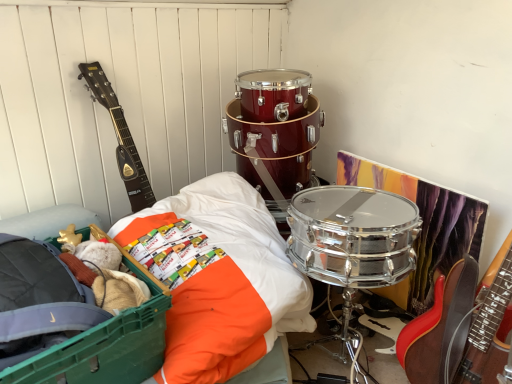
Question: Considering the relative sizes of orange fabric bedsheet at center-left and green plastic storage box at lower left in the image provided, is orange fabric bedsheet at center-left taller than green plastic storage box at lower left?

Choices:
 (A) no
 (B) yes

Answer: (B)

Question: Is orange fabric bedsheet at center-left placed right next to green plastic storage box at lower left?

Choices:
 (A) yes
 (B) no

Answer: (B)

Question: From a real-world perspective, is orange fabric bedsheet at center-left on top of green plastic storage box at lower left?

Choices:
 (A) yes
 (B) no

Answer: (B)

Question: Is orange fabric bedsheet at center-left wider than green plastic storage box at lower left?

Choices:
 (A) no
 (B) yes

Answer: (B)

Question: From a real-world perspective, is orange fabric bedsheet at center-left positioned under green plastic storage box at lower left based on gravity?

Choices:
 (A) yes
 (B) no

Answer: (A)

Question: Which is correct: orange fabric bedsheet at center-left is inside dark wood acoustic guitar at left, or outside of it?

Choices:
 (A) outside
 (B) inside

Answer: (A)

Question: From a real-world perspective, is orange fabric bedsheet at center-left above or below dark wood acoustic guitar at left?

Choices:
 (A) above
 (B) below

Answer: (B)

Question: Looking at their shapes, would you say orange fabric bedsheet at center-left is wider or thinner than dark wood acoustic guitar at left?

Choices:
 (A) wide
 (B) thin

Answer: (A)

Question: Based on their positions, is orange fabric bedsheet at center-left located to the left or right of dark wood acoustic guitar at left?

Choices:
 (A) right
 (B) left

Answer: (A)

Question: From a real-world perspective, is green plastic storage box at lower left above or below orange fabric bedsheet at center-left?

Choices:
 (A) below
 (B) above

Answer: (B)

Question: Is green plastic storage box at lower left in front of or behind orange fabric bedsheet at center-left in the image?

Choices:
 (A) front
 (B) behind

Answer: (A)

Question: Considering the positions of green plastic storage box at lower left and orange fabric bedsheet at center-left in the image, is green plastic storage box at lower left taller or shorter than orange fabric bedsheet at center-left?

Choices:
 (A) tall
 (B) short

Answer: (B)

Question: Is point (82, 334) positioned closer to the camera than point (143, 213)?

Choices:
 (A) farther
 (B) closer

Answer: (B)

Question: Looking at the image, does dark wood acoustic guitar at left seem bigger or smaller compared to green plastic storage box at lower left?

Choices:
 (A) big
 (B) small

Answer: (B)

Question: Considering the positions of point (132, 208) and point (158, 281), is point (132, 208) closer or farther from the camera than point (158, 281)?

Choices:
 (A) closer
 (B) farther

Answer: (B)